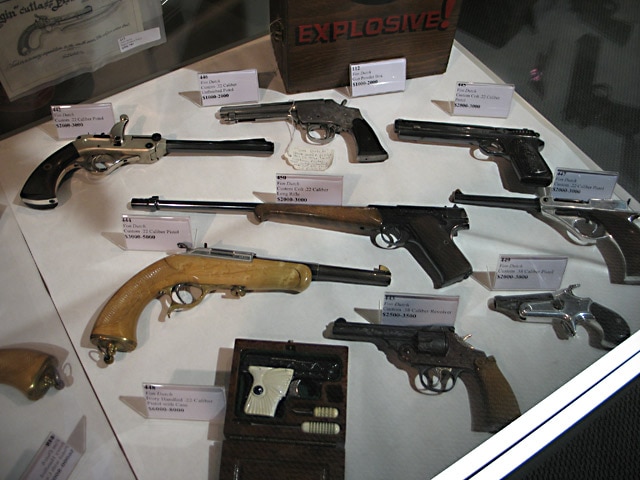
You are a GUI agent. You are given a task and a screenshot of the screen. Output one action in this format:
    pyautogui.click(x=<x>, y=<y>)
    Task: Click on the wood box
    The image size is (640, 480).
    Given the screenshot: What is the action you would take?
    (x=326, y=55)